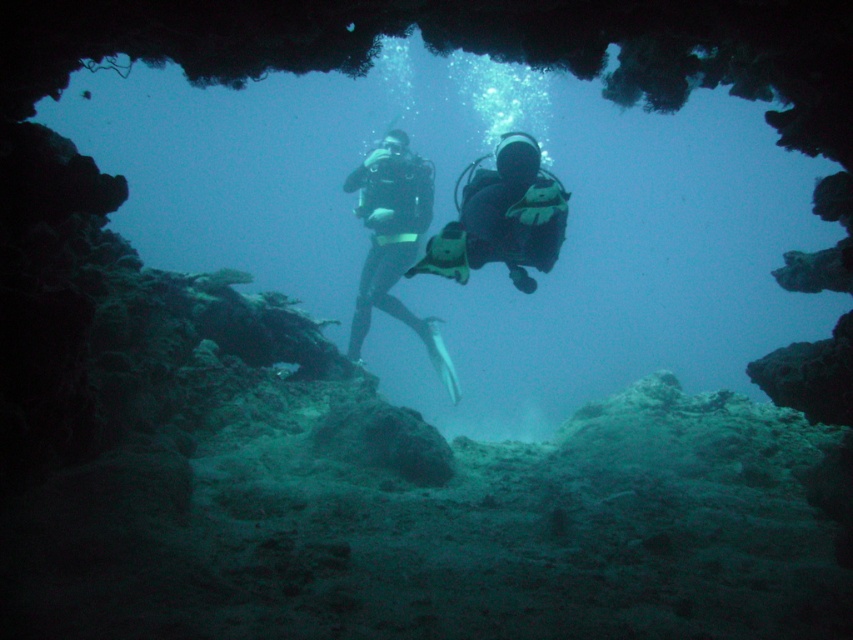
Between black matte wetsuit at center and black matte scuba diver at center, which one is positioned higher?

Positioned higher is black matte wetsuit at center.

At what (x,y) coordinates should I click in order to perform the action: click on black matte wetsuit at center. Please return your answer as a coordinate pair (x, y). The image size is (853, 640). Looking at the image, I should click on (502, 218).

Where is `black matte wetsuit at center`? The height and width of the screenshot is (640, 853). black matte wetsuit at center is located at coordinates (502, 218).